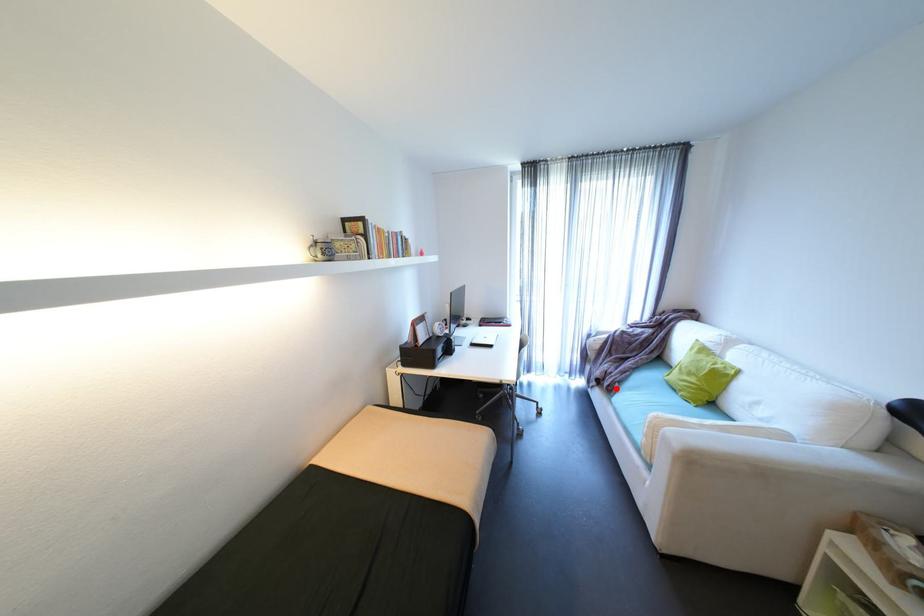
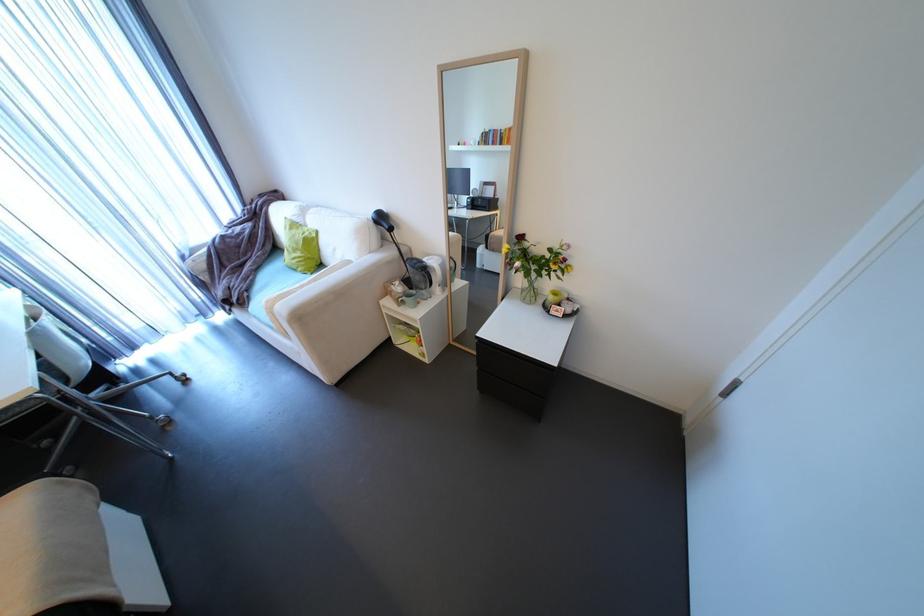
Question: I am providing you with two images of the same scene from different viewpoints. Image1 has a red point marked. In image2, the corresponding 3D location appears at what relative position? Reply with the corresponding letter.

Choices:
 (A) Closer
 (B) Farther

Answer: (B)